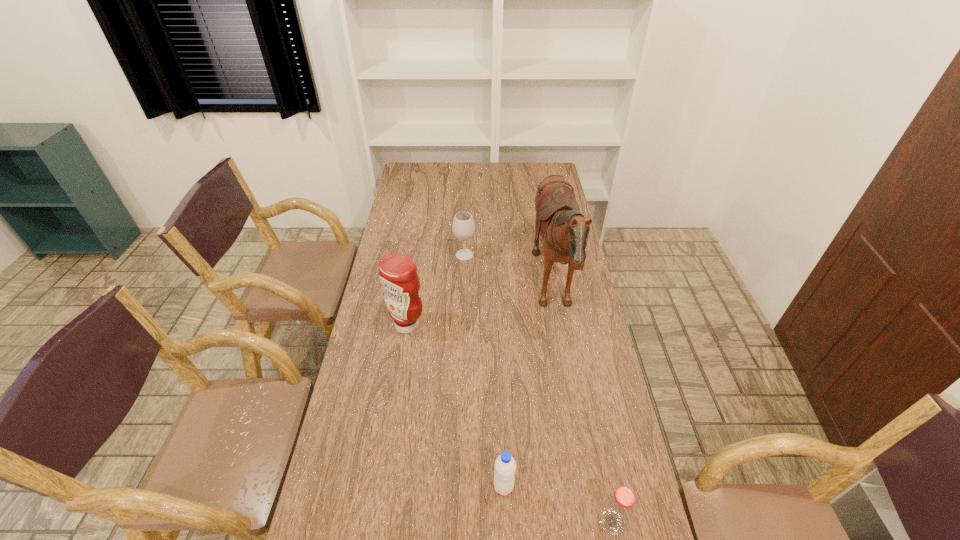
Find the location of `free area in between the tallest object and the leftmost object`. free area in between the tallest object and the leftmost object is located at coordinates (480, 308).

Identify the location of vacant point located between the saddle and the second tallest object. (480, 308).

Locate an element on the screen. The width and height of the screenshot is (960, 540). blank region between the bottle and the saddle is located at coordinates (582, 406).

You are a GUI agent. You are given a task and a screenshot of the screen. Output one action in this format:
    pyautogui.click(x=<x>, y=<y>)
    Task: Click on the vacant point located between the wineglass and the third object from right to left
    Image resolution: width=960 pixels, height=540 pixels.
    Given the screenshot: What is the action you would take?
    pyautogui.click(x=484, y=371)

Find the location of a particular element. empty space that is in between the saddle and the water bottle is located at coordinates (528, 389).

Locate an element on the screen. This screenshot has height=540, width=960. vacant region between the fourth object from right to left and the water bottle is located at coordinates (484, 371).

Locate an element on the screen. This screenshot has width=960, height=540. vacant space in between the fourth farthest object and the tallest object is located at coordinates (528, 389).

Where is `free spot between the third object from right to left and the fourth object from right to left`? The image size is (960, 540). free spot between the third object from right to left and the fourth object from right to left is located at coordinates (484, 371).

Locate an element on the screen. vacant space in between the nearest object and the fourth object from right to left is located at coordinates (538, 388).

I want to click on the third closest object to the bottle, so click(398, 275).